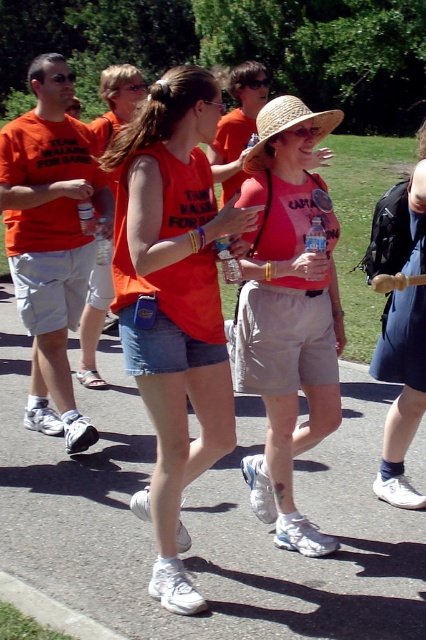
Does denim shorts at center have a larger size compared to strawmaterial/texturehat at center?

No.

The height and width of the screenshot is (640, 426). In order to click on denim shorts at center in this screenshot , I will do `click(402, 388)`.

Where is `denim shorts at center`? denim shorts at center is located at coordinates (402, 388).

Between point (161, 285) and point (279, 305), which one is positioned behind?

The point (279, 305) is behind.

Which is in front, point (117, 216) or point (288, 188)?

Point (117, 216) is more forward.

This screenshot has height=640, width=426. Identify the location of orange cotton tank top at center. (173, 301).

Is orange cotton tank top at center positioned behind strawmaterial/texturehat at center?

No, orange cotton tank top at center is in front of strawmaterial/texturehat at center.

Does orange cotton tank top at center appear under strawmaterial/texturehat at center?

Correct, orange cotton tank top at center is located below strawmaterial/texturehat at center.

Does point (227, 448) come behind point (331, 109)?

No, it is not.

Identify the location of orange cotton tank top at center. (173, 301).